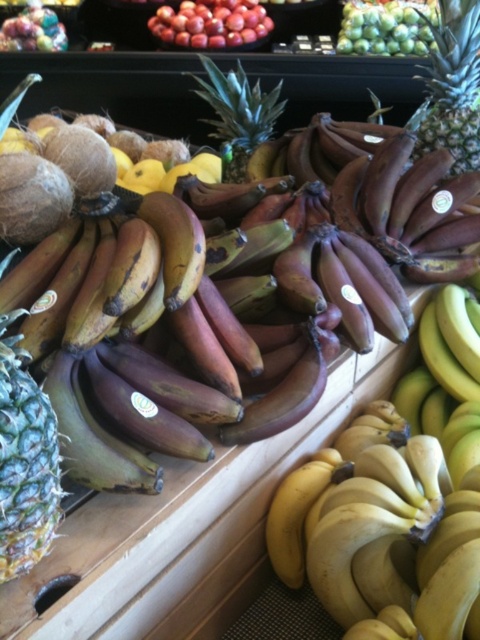
You are standing in front of the tropical fruit display and need to reach two points to place stickers. The first point is at coordinate point(432,80) and the second is at point(237,140). Which point is closer to you?

Point(432,80) is closer to the viewer than point(237,140), so you should reach for point(432,80) first.

You are a customer at the market and want to pick up the green spiky pineapple at center and the shiny red apples at upper center. Which one is closer to your hand if you reach down from above?

The green spiky pineapple at center is located below the shiny red apples at upper center, so it is closer to your hand when reaching down from above.

You are a customer in the market and want to locate the green spiky pineapple at center. According to the coordinates provided, where exactly is it located?

The green spiky pineapple at center is located at point [238,115].